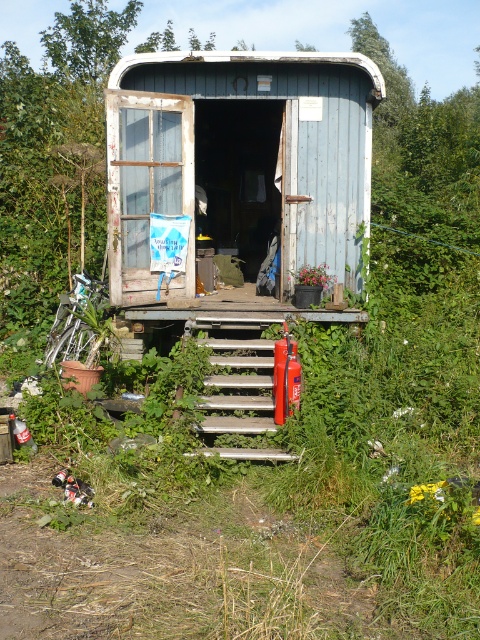
You are a visitor arriving at the wooden cabin at center and notice the red matte fire extinguisher at center nearby. Can you determine which object is wider based on their sizes?

The wooden cabin at center is wider than the red matte fire extinguisher at center according to the description.

You are standing at the entrance of the rustic structure and need to locate the red matte fire extinguisher at center. Based on the metallic silver stairs at center, where would you find the fire extinguisher relative to the stairs?

The red matte fire extinguisher at center is to the right of the metallic silver stairs at center.

You are a visitor approaching the wooden cabin at center and the red matte fire extinguisher at center. Which object will appear larger in your view as you get closer?

The wooden cabin at center will appear larger in your view as you get closer because it is taller than the red matte fire extinguisher at center.